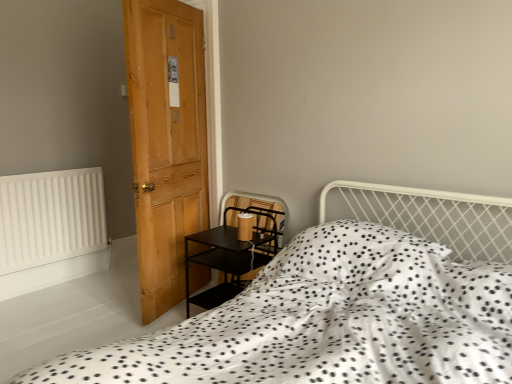
Question: From a real-world perspective, is white matte radiator at left below white dotted fabric at center?

Choices:
 (A) yes
 (B) no

Answer: (A)

Question: Is white matte radiator at left surrounding white dotted fabric at center?

Choices:
 (A) no
 (B) yes

Answer: (A)

Question: From the image's perspective, is white matte radiator at left on white dotted fabric at center?

Choices:
 (A) no
 (B) yes

Answer: (B)

Question: Can you confirm if white matte radiator at left is positioned to the left of white dotted fabric at center?

Choices:
 (A) no
 (B) yes

Answer: (B)

Question: Can you confirm if white matte radiator at left is bigger than white dotted fabric at center?

Choices:
 (A) yes
 (B) no

Answer: (B)

Question: Is black matte side table at lower left taller or shorter than light brown wooden door at left?

Choices:
 (A) short
 (B) tall

Answer: (A)

Question: Is black matte side table at lower left inside the boundaries of light brown wooden door at left, or outside?

Choices:
 (A) inside
 (B) outside

Answer: (B)

Question: From a real-world perspective, is black matte side table at lower left above or below light brown wooden door at left?

Choices:
 (A) above
 (B) below

Answer: (B)

Question: Relative to light brown wooden door at left, is black matte side table at lower left in front or behind?

Choices:
 (A) behind
 (B) front

Answer: (A)

Question: Considering the relative positions of light brown wooden door at left and white matte radiator at left in the image provided, is light brown wooden door at left to the left or to the right of white matte radiator at left?

Choices:
 (A) right
 (B) left

Answer: (A)

Question: Is light brown wooden door at left inside or outside of white matte radiator at left?

Choices:
 (A) inside
 (B) outside

Answer: (B)

Question: From a real-world perspective, is light brown wooden door at left above or below white matte radiator at left?

Choices:
 (A) below
 (B) above

Answer: (B)

Question: Considering the positions of light brown wooden door at left and white matte radiator at left in the image, is light brown wooden door at left bigger or smaller than white matte radiator at left?

Choices:
 (A) big
 (B) small

Answer: (A)

Question: Considering the positions of light brown wooden door at left and black matte side table at lower left in the image, is light brown wooden door at left bigger or smaller than black matte side table at lower left?

Choices:
 (A) small
 (B) big

Answer: (B)

Question: Considering their positions, is light brown wooden door at left located in front of or behind black matte side table at lower left?

Choices:
 (A) front
 (B) behind

Answer: (A)